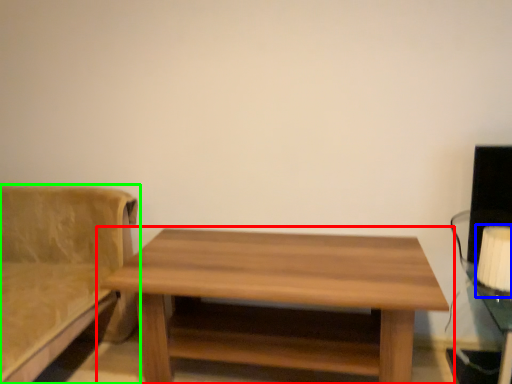
Question: Estimate the real-world distances between objects in this image. Which object is farther from table (highlighted by a red box), table lamp (highlighted by a blue box) or studio couch (highlighted by a green box)?

Choices:
 (A) table lamp
 (B) studio couch

Answer: (A)